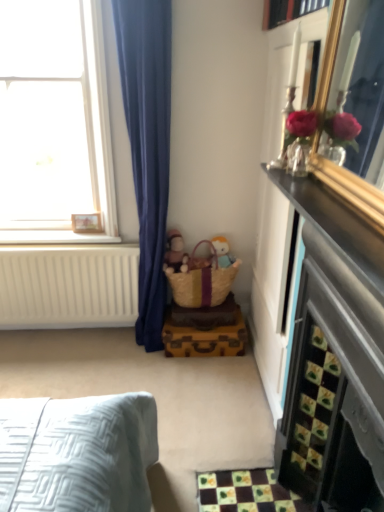
Find the location of a particular element. This screenshot has height=512, width=384. vacant space that is to the left of wooden picture frame at upper left is located at coordinates (55, 236).